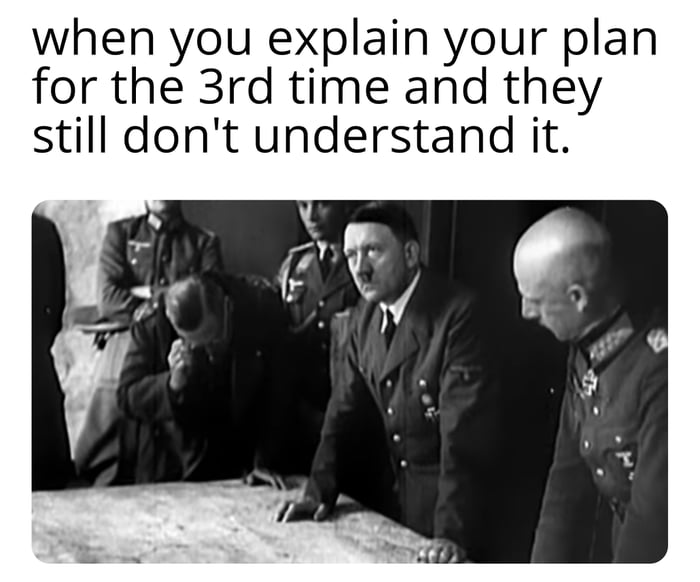
The height and width of the screenshot is (582, 700). In order to click on dark background wall in this screenshot , I will do `click(474, 233)`, `click(234, 223)`.